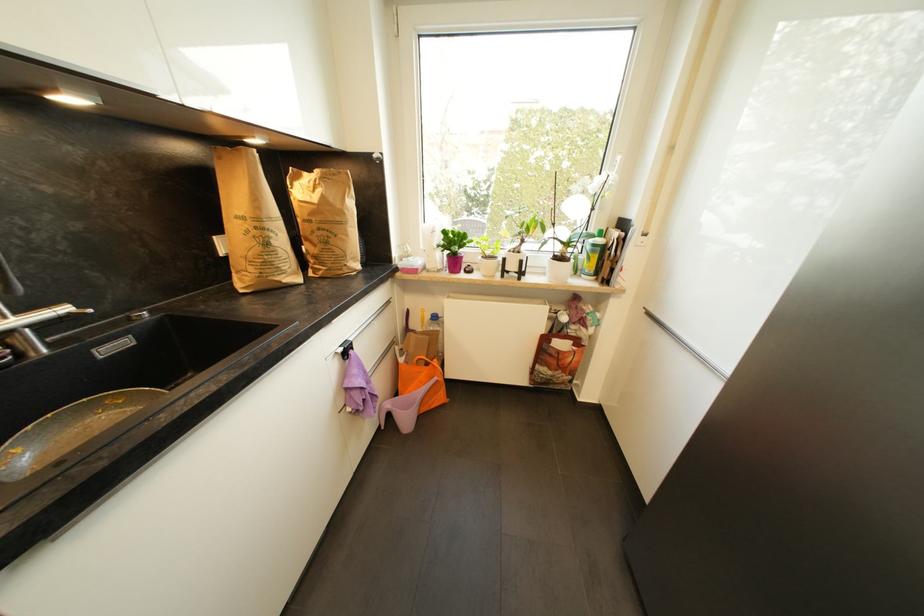
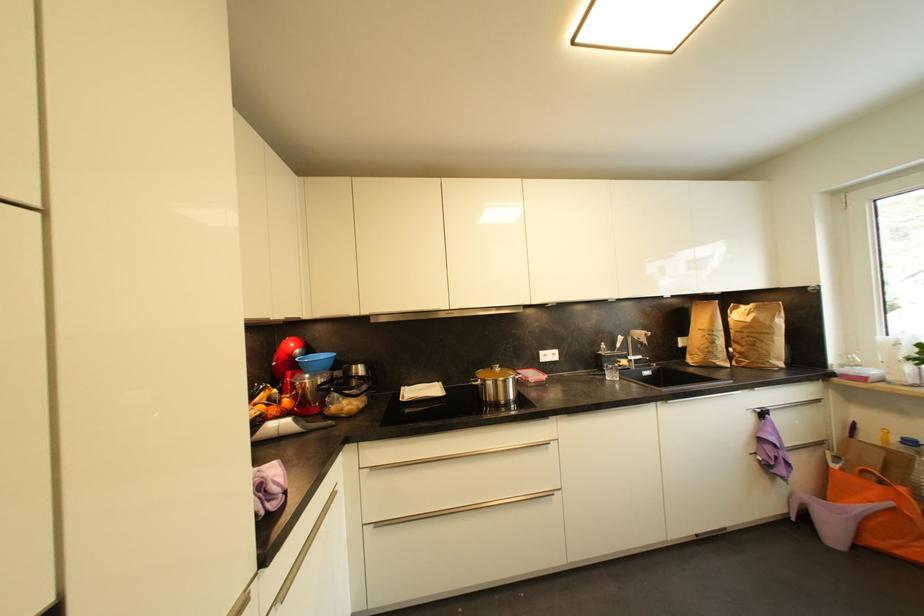
The point at (69, 312) is marked in the first image. Where is the corresponding point in the second image?

(645, 359)